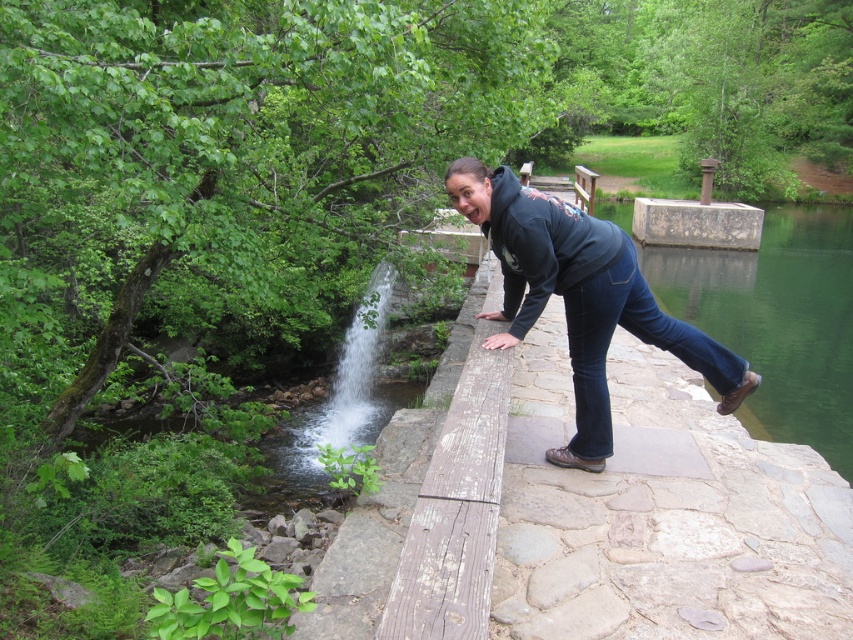
Based on the photo, you are a photographer trying to capture a photo of the dark blue hoodie at center and the clear water at center. Which object is wider in the image?

The dark blue hoodie at center is wider than the clear water at center.

You are a photographer trying to capture the scene of the person leaning over the bridge. Since the dark blue hoodie at center and clear water at center are both at the center, which one is closer to the camera?

The dark blue hoodie at center is positioned under clear water at center, so the clear water at center is closer to the camera.